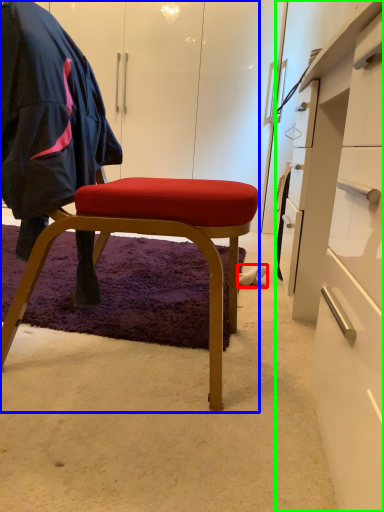
Question: Based on their relative distances, which object is farther from footwear (highlighted by a red box)? Choose from chair (highlighted by a blue box) and desk (highlighted by a green box).

Choices:
 (A) chair
 (B) desk

Answer: (A)